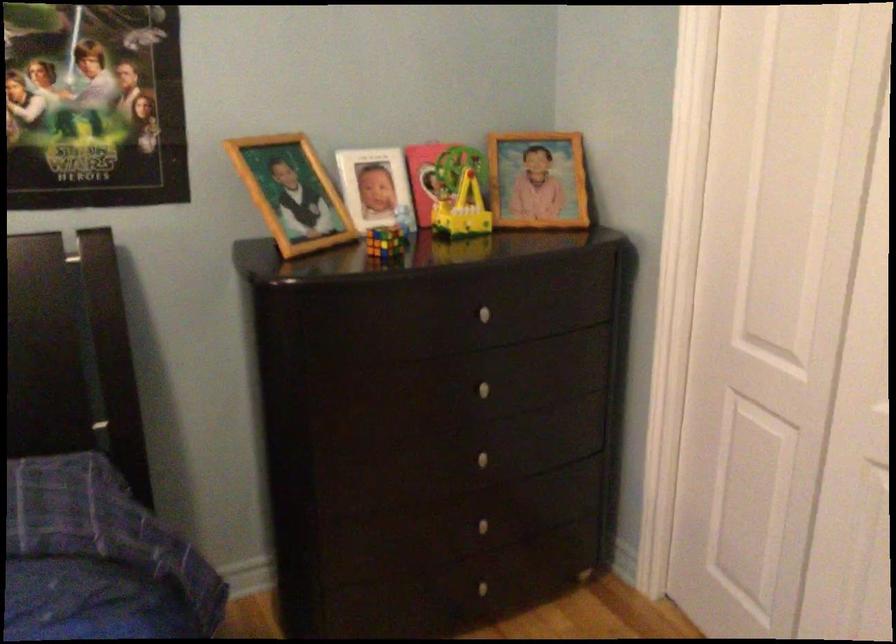
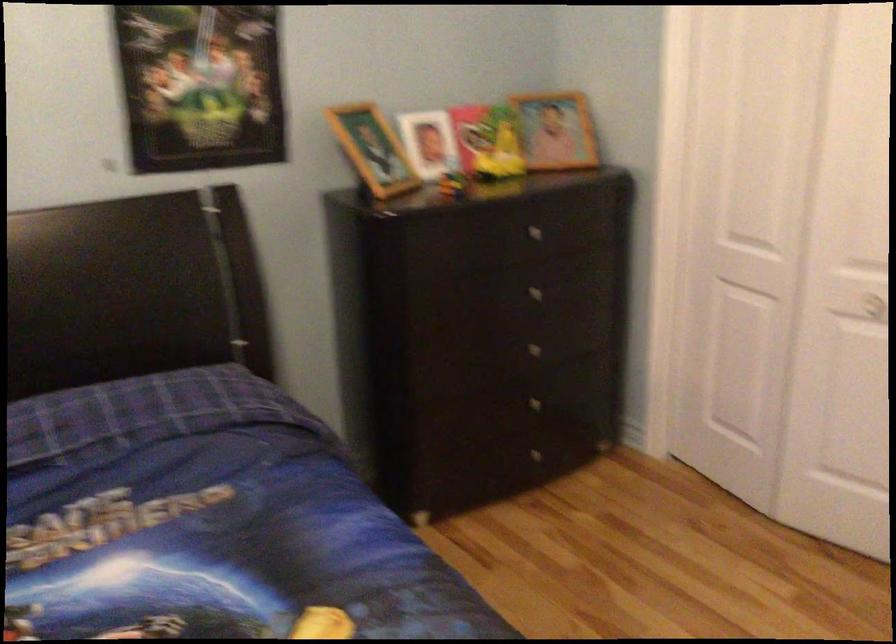
In a continuous first-person perspective shot, in which direction is the camera moving?

The cameraman walked toward left, backward.